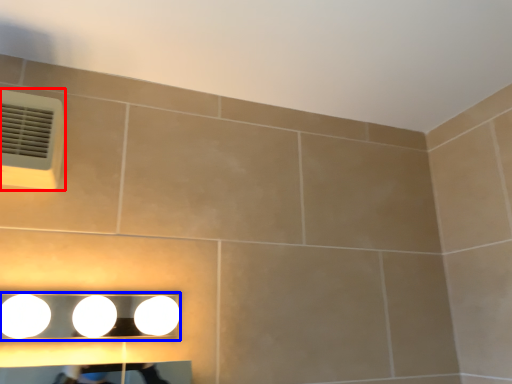
Question: Which object is closer to the camera taking this photo, air conditioning (highlighted by a red box) or fixture (highlighted by a blue box)?

Choices:
 (A) air conditioning
 (B) fixture

Answer: (B)